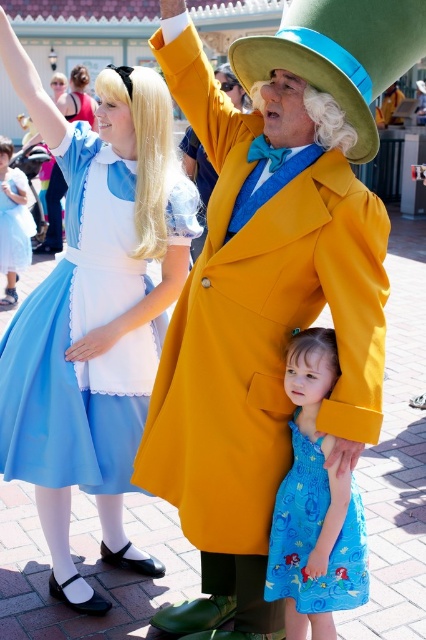
From the picture: Who is positioned more to the right, green felt dress hat at upper center or blue printed fabric dress at lower center?

Positioned to the right is green felt dress hat at upper center.

Does green felt dress hat at upper center have a lesser width compared to blue printed fabric dress at lower center?

No, green felt dress hat at upper center is not thinner than blue printed fabric dress at lower center.

Does point (371, 44) lie in front of point (308, 483)?

Yes, point (371, 44) is in front of point (308, 483).

Locate an element on the screen. green felt dress hat at upper center is located at coordinates (339, 54).

Does matte yellow coat at center appear on the right side of matte blue fabric dress at left?

Yes, matte yellow coat at center is to the right of matte blue fabric dress at left.

Does matte yellow coat at center appear under matte blue fabric dress at left?

Yes.

Does point (284, 205) lie in front of point (115, 344)?

Yes, it is.

In order to click on matte yellow coat at center in this screenshot , I will do `click(275, 300)`.

Which of these two, blue printed fabric dress at lower center or light blue satin dress at left, stands taller?

Standing taller between the two is light blue satin dress at left.

Is point (279, 564) more distant than point (13, 211)?

No, it is in front of (13, 211).

Where is `blue printed fabric dress at lower center`? The width and height of the screenshot is (426, 640). blue printed fabric dress at lower center is located at coordinates (314, 536).

Locate an element on the screen. The height and width of the screenshot is (640, 426). blue printed fabric dress at lower center is located at coordinates (314, 536).